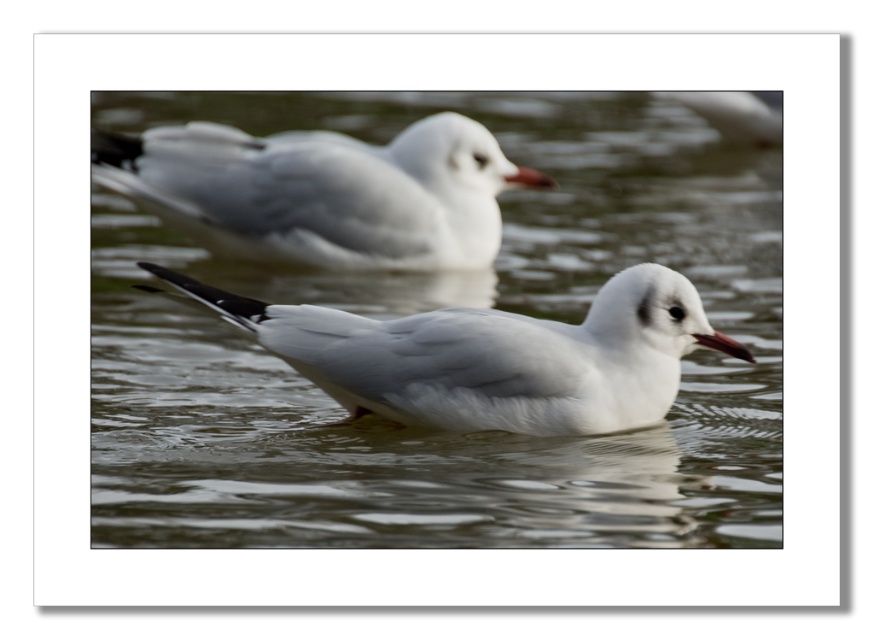
The image size is (874, 640). What do you see at coordinates (429, 308) in the screenshot? I see `clear water at center` at bounding box center [429, 308].

Is clear water at center bigger than white matte bird at center?

Actually, clear water at center might be smaller than white matte bird at center.

Does point (244, 532) lie behind point (671, 337)?

That is False.

You are a GUI agent. You are given a task and a screenshot of the screen. Output one action in this format:
    pyautogui.click(x=<x>, y=<y>)
    Task: Click on the clear water at center
    
    Given the screenshot: What is the action you would take?
    pyautogui.click(x=429, y=308)

Is white matte bird at center wider than white matte bird at upper center?

In fact, white matte bird at center might be narrower than white matte bird at upper center.

The height and width of the screenshot is (640, 874). What do you see at coordinates (491, 356) in the screenshot?
I see `white matte bird at center` at bounding box center [491, 356].

Locate an element on the screen. This screenshot has width=874, height=640. white matte bird at center is located at coordinates (491, 356).

Does clear water at center have a lesser width compared to matte red beak at center?

No.

Measure the distance between clear water at center and matte red beak at center.

clear water at center and matte red beak at center are 1.20 meters apart.

Between point (271, 518) and point (535, 173), which one is positioned in front?

Point (271, 518) is more forward.

Identify the location of clear water at center. The height and width of the screenshot is (640, 874). (429, 308).